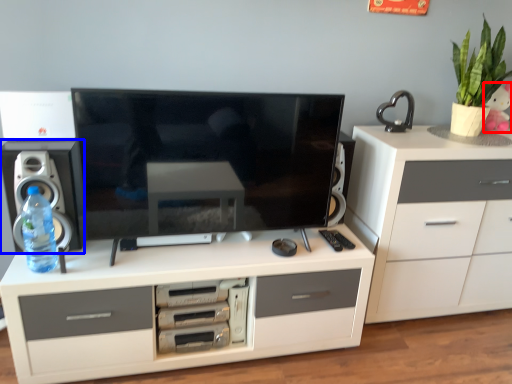
Question: Which object appears farthest to the camera in this image, toy (highlighted by a red box) or speaker (highlighted by a blue box)?

Choices:
 (A) toy
 (B) speaker

Answer: (A)